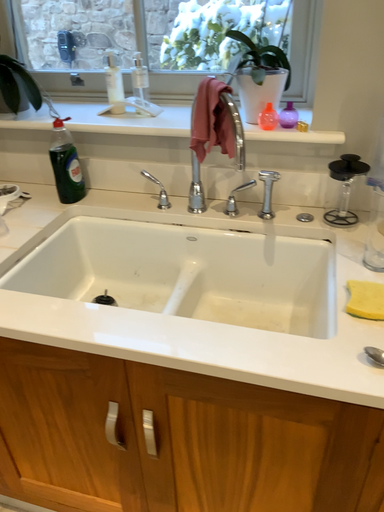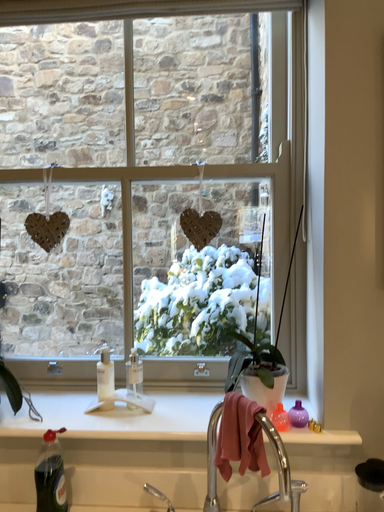
Question: How did the camera likely rotate when shooting the video?

Choices:
 (A) rotated left
 (B) rotated right

Answer: (B)